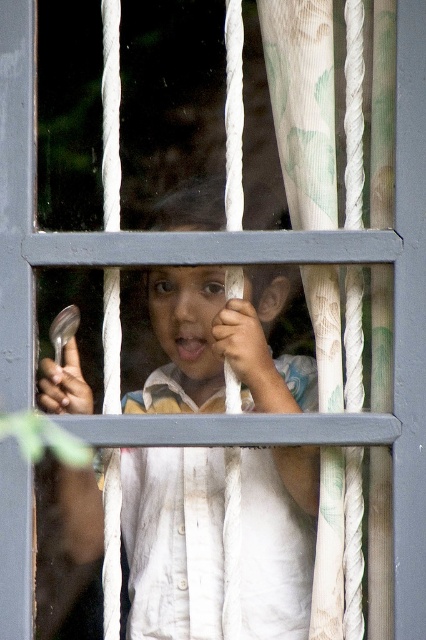
You are a photographer trying to capture the child in the scene. Since the white cotton shirt at center and the white textured curtain at right are both white, how can you ensure the child stands out in the photo?

The white cotton shirt at center has a larger size compared to the white textured curtain at right, so focusing on the size difference will help the child stand out against the curtain.

You are a photographer trying to capture the child in the scene. The white cotton shirt at center and the white textured curtain at right are both in your view. Which object is closer to your camera lens?

The white cotton shirt at center is closer to the camera lens because it is further to the viewer than the white textured curtain at right.

You are standing in front of a window with bars and a curtain. There is a point at coordinates point (x=215, y=228). If you want to reach that point with a 6.5 feet long pole, will the pole be long enough?

The point at point (x=215, y=228) is 7.03 feet away from the viewer. Since the pole is only 6.5 feet long, it will not be long enough to reach the point.